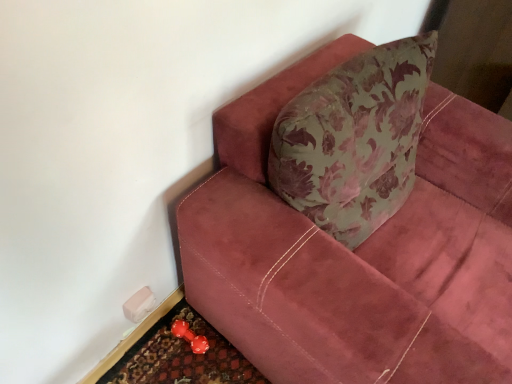
Question: Looking at their shapes, would you say rubberized red dumbbell at lower left is wider or thinner than velvet maroon couch at upper right?

Choices:
 (A) wide
 (B) thin

Answer: (B)

Question: Does point (198, 347) appear closer or farther from the camera than point (338, 370)?

Choices:
 (A) closer
 (B) farther

Answer: (B)

Question: Which of these objects is positioned closest to the velvet maroon couch at upper right?

Choices:
 (A) rubberized red dumbbell at lower left
 (B) rubberized red doormat at lower left

Answer: (B)

Question: Which of these objects is positioned closest to the rubberized red doormat at lower left?

Choices:
 (A) rubberized red dumbbell at lower left
 (B) velvet maroon couch at upper right

Answer: (A)